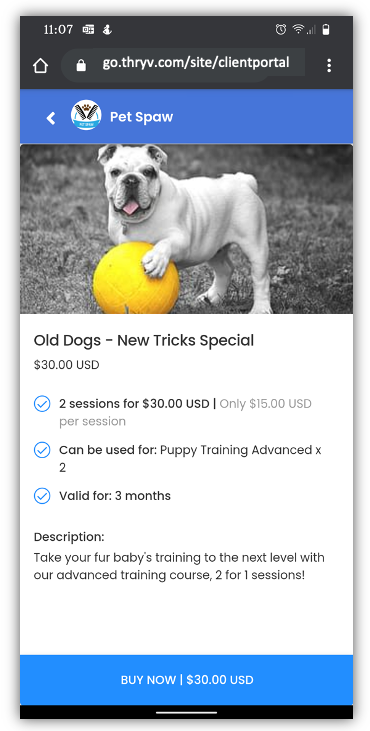
Image resolution: width=370 pixels, height=731 pixels. I want to click on alarm set indicator, so (x=279, y=26).